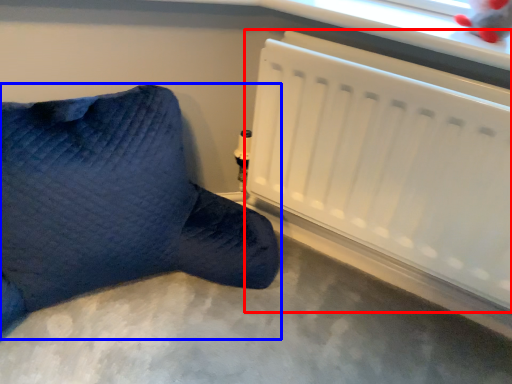
Question: Among these objects, which one is nearest to the camera, radiator (highlighted by a red box) or furniture (highlighted by a blue box)?

Choices:
 (A) radiator
 (B) furniture

Answer: (B)